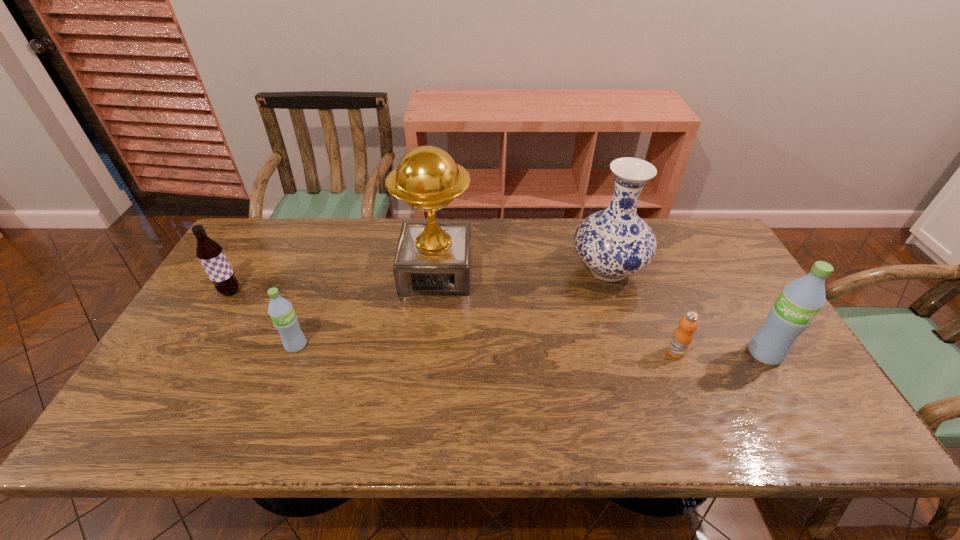
Where is `vacant space located 0.130m on the front-facing side of the award`? The image size is (960, 540). vacant space located 0.130m on the front-facing side of the award is located at coordinates 430,332.

Where is `free space located 0.200m on the front of the leftmost object`? free space located 0.200m on the front of the leftmost object is located at coordinates (193, 356).

I want to click on vacant space located 0.160m on the left of the vase, so click(518, 269).

Locate an element on the screen. This screenshot has height=540, width=960. free space located on the front label of the shortest object is located at coordinates (691, 390).

What are the coordinates of `award positioned at the far edge` in the screenshot? It's located at (433, 258).

Identify the location of vase situated at the far edge. (614, 243).

Identify the location of object that is positioned at the left edge. (211, 255).

Where is `object positioned at the right edge`? object positioned at the right edge is located at coordinates (800, 301).

Locate an element on the screen. This screenshot has height=540, width=960. vacant region at the far edge of the desktop is located at coordinates (384, 255).

Image resolution: width=960 pixels, height=540 pixels. In the image, there is a desktop. Find the location of `vacant region at the near edge`. vacant region at the near edge is located at coordinates (723, 374).